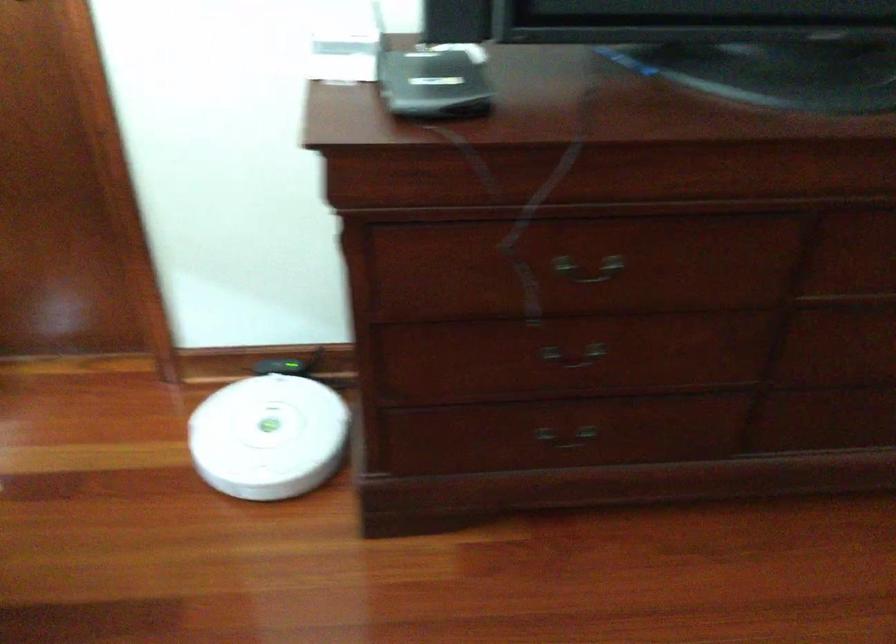
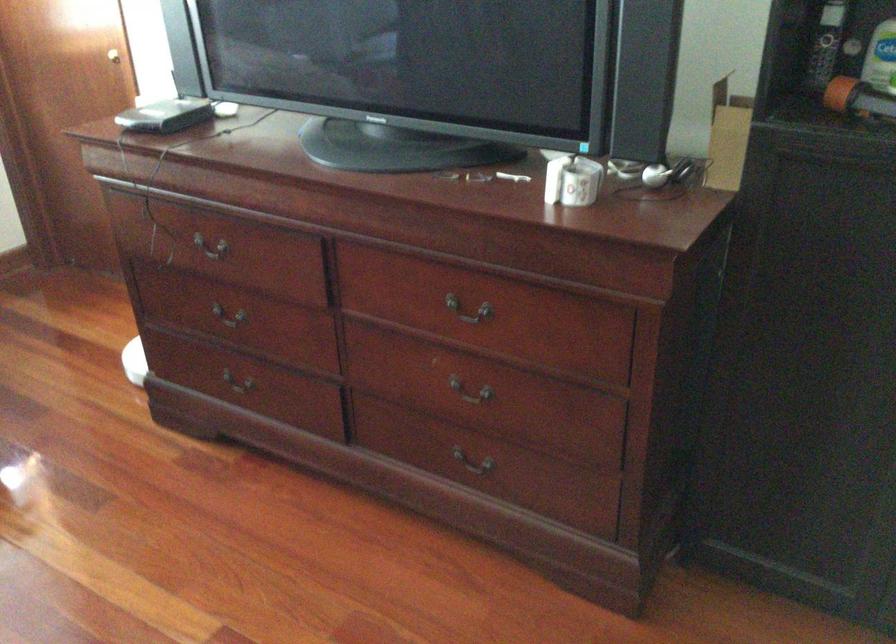
In the second image, find the point that corresponds to the point at 538,241 in the first image.

(211, 241)